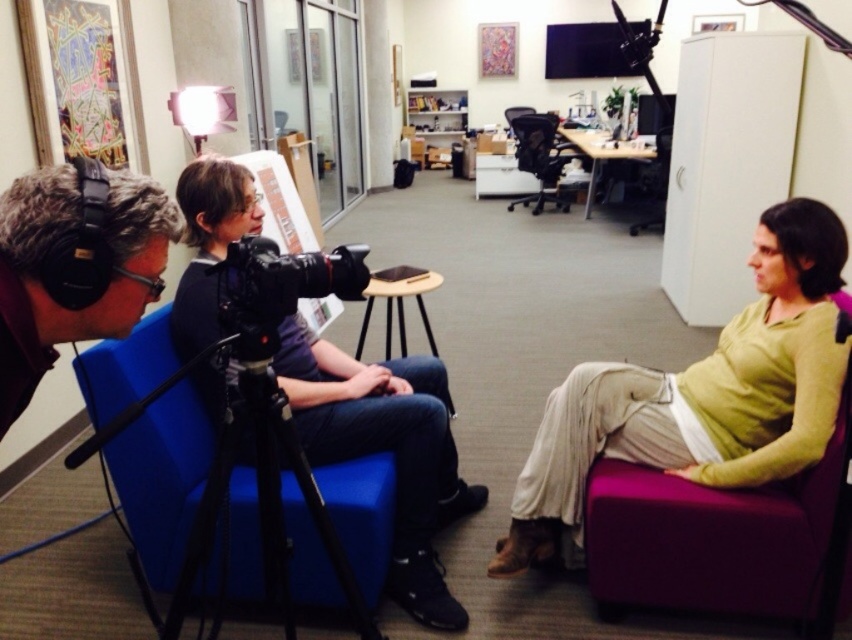
Question: Is matte black camera at center to the left of purple fabric swivel chair at right from the viewer's perspective?

Choices:
 (A) no
 (B) yes

Answer: (B)

Question: Among these objects, which one is nearest to the camera?

Choices:
 (A) matte green shirt at right
 (B) matte black camera at center
 (C) black matte headphones at left

Answer: (C)

Question: Is purple fabric swivel chair at right bigger than black matte camera at center?

Choices:
 (A) no
 (B) yes

Answer: (B)

Question: Is purple fabric swivel chair at right wider than black matte headphones at left?

Choices:
 (A) yes
 (B) no

Answer: (A)

Question: Which point is closer to the camera?

Choices:
 (A) (90, 278)
 (B) (231, 244)

Answer: (A)

Question: Which of the following is the farthest from the observer?

Choices:
 (A) (337, 276)
 (B) (226, 547)
 (C) (220, 211)
 (D) (786, 490)

Answer: (D)